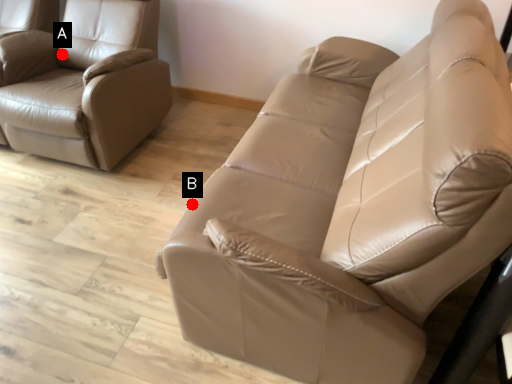
Question: Two points are circled on the image, labeled by A and B beside each circle. Which point is closer to the camera?

Choices:
 (A) A is closer
 (B) B is closer

Answer: (B)